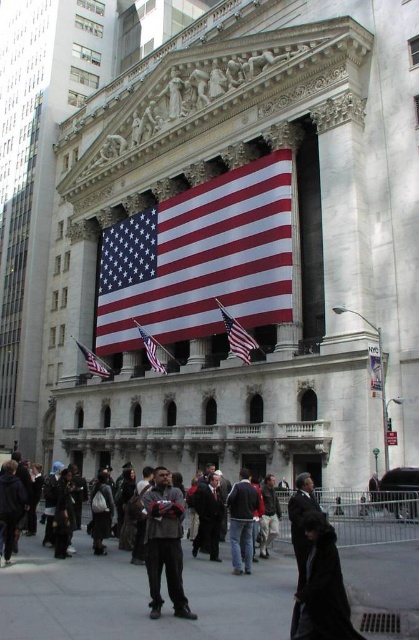
Question: Does dark gray jacket at center lie behind matte fabric flag at center?

Choices:
 (A) yes
 (B) no

Answer: (B)

Question: Which point is farther to the camera?

Choices:
 (A) (82, 349)
 (B) (315, 564)
 (C) (250, 499)
 (D) (243, 346)

Answer: (A)

Question: Can you confirm if dark brown leather coat at lower right is positioned above dark blue jeans at center?

Choices:
 (A) no
 (B) yes

Answer: (B)

Question: Is dark blue jeans at center smaller than matte fabric flag at lower left?

Choices:
 (A) yes
 (B) no

Answer: (B)

Question: Which of the following is the farthest from the observer?

Choices:
 (A) matte fabric flag at center
 (B) red fabric flag at center
 (C) dark gray jacket at center

Answer: (A)

Question: Which of these objects is positioned closest to the dark gray jacket at center?

Choices:
 (A) matte fabric flag at lower left
 (B) dark blue jeans at center

Answer: (B)